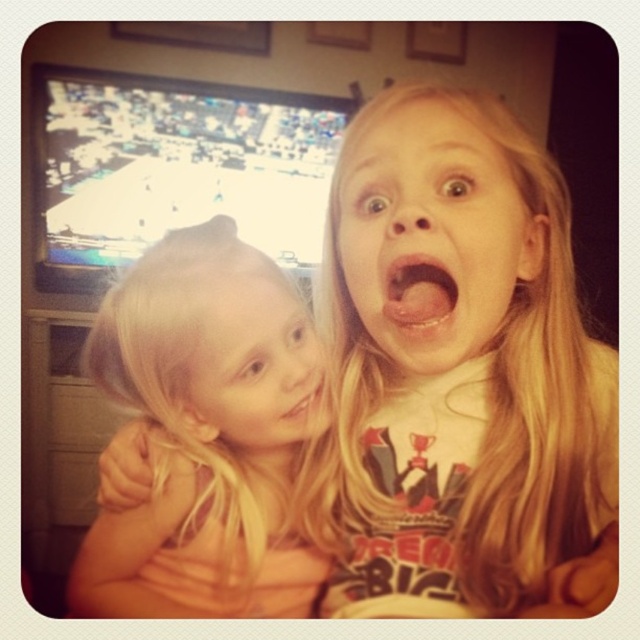
Who is positioned more to the left, blonde hair at left or pink matte lips at center?

blonde hair at left

Which of these two, blonde hair at left or pink matte lips at center, stands taller?

blonde hair at left

Locate an element on the screen. The width and height of the screenshot is (640, 640). blonde hair at left is located at coordinates (205, 435).

What are the coordinates of `blonde hair at left` in the screenshot? It's located at (205, 435).

Can you confirm if blonde hair at center is bigger than pink matte lips at center?

Correct, blonde hair at center is larger in size than pink matte lips at center.

I want to click on blonde hair at center, so click(x=432, y=236).

The width and height of the screenshot is (640, 640). Identify the location of blonde hair at center. (432, 236).

You are a GUI agent. You are given a task and a screenshot of the screen. Output one action in this format:
    pyautogui.click(x=<x>, y=<y>)
    Task: Click on the blonde hair at center
    The image size is (640, 640).
    Given the screenshot: What is the action you would take?
    pyautogui.click(x=432, y=236)

From the picture: Is blonde hair at center thinner than pink glossy lips at center?

In fact, blonde hair at center might be wider than pink glossy lips at center.

Who is more forward, (424, 125) or (435, 282)?

Point (424, 125)

You are a GUI agent. You are given a task and a screenshot of the screen. Output one action in this format:
    pyautogui.click(x=<x>, y=<y>)
    Task: Click on the blonde hair at center
    
    Given the screenshot: What is the action you would take?
    pyautogui.click(x=432, y=236)